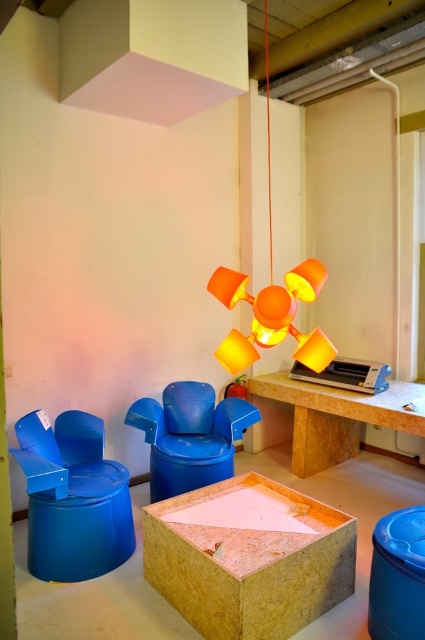
Question: Estimate the real-world distances between objects in this image. Which object is closer to the wooden at center?

Choices:
 (A) orange matte lampshade at center
 (B) blue plastic chair at lower left
 (C) blue plastic lid at lower right
 (D) matte plastic chair at center

Answer: (C)

Question: Considering the relative positions of matte plastic chair at center and wooden table at center in the image provided, where is matte plastic chair at center located with respect to wooden table at center?

Choices:
 (A) right
 (B) left

Answer: (B)

Question: Is blue plastic chair at lower left positioned at the back of matte plastic chair at center?

Choices:
 (A) no
 (B) yes

Answer: (A)

Question: Can you confirm if wooden at center is positioned to the left of wooden table at center?

Choices:
 (A) yes
 (B) no

Answer: (A)

Question: Which point appears farthest from the camera in this image?

Choices:
 (A) click(x=42, y=500)
 (B) click(x=402, y=540)

Answer: (A)

Question: Which of these objects is positioned farthest from the matte plastic chair at center?

Choices:
 (A) blue plastic chair at lower left
 (B) blue plastic lid at lower right

Answer: (B)